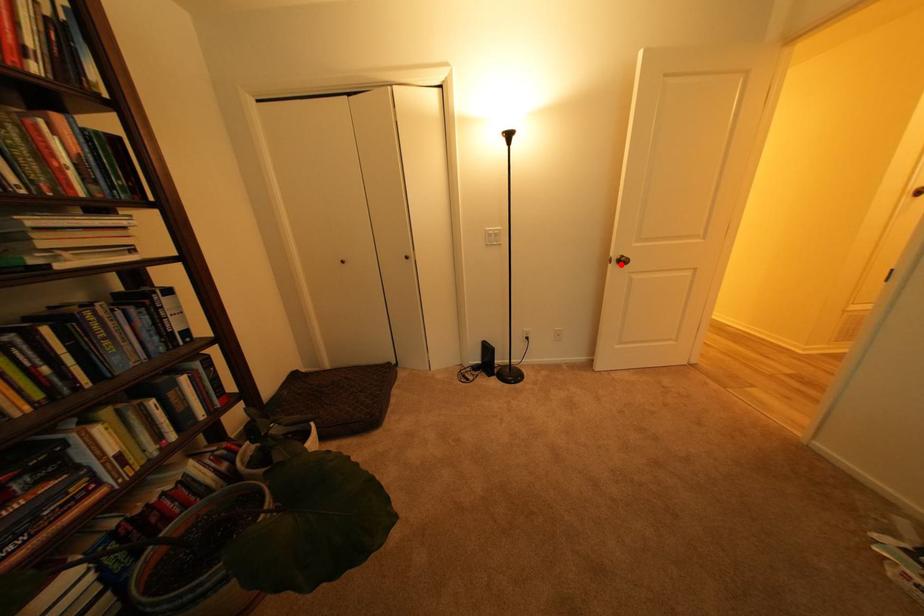
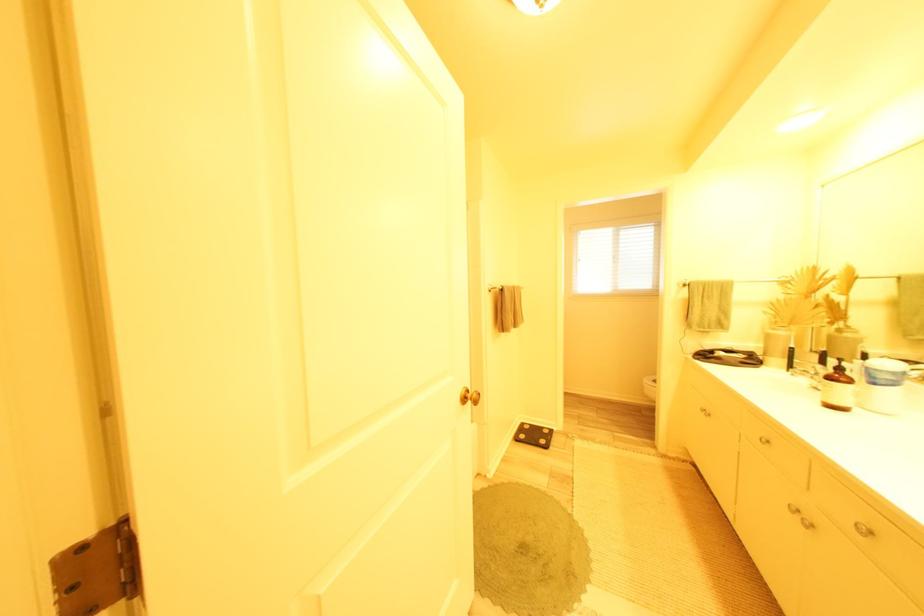
Question: I am providing you with two images of the same scene from different viewpoints. A red point is marked on the first image. Is the red point's position out of view in image 2?

Choices:
 (A) Yes
 (B) No

Answer: (A)